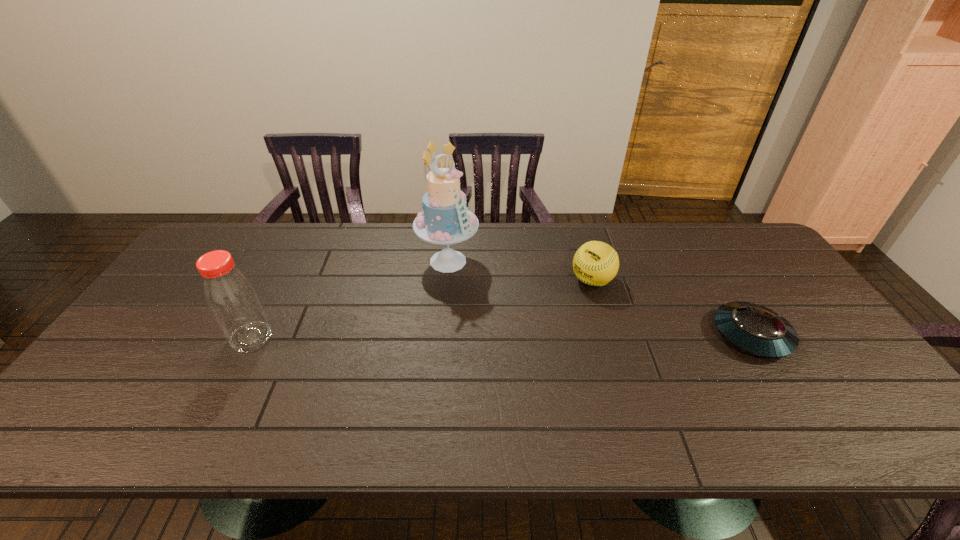
Identify the location of the third shortest object. This screenshot has width=960, height=540. (230, 296).

Locate an element on the screen. The height and width of the screenshot is (540, 960). bottle is located at coordinates (230, 296).

Where is `the rightmost object`? This screenshot has width=960, height=540. the rightmost object is located at coordinates (757, 330).

I want to click on the shortest object, so click(757, 330).

The height and width of the screenshot is (540, 960). In order to click on the third tallest object in this screenshot , I will do `click(595, 263)`.

The image size is (960, 540). I want to click on softball, so click(x=595, y=263).

Where is `cake`? This screenshot has height=540, width=960. cake is located at coordinates (446, 220).

Locate an element on the screen. the tallest object is located at coordinates (446, 220).

Where is `free region located 0.160m on the back of the leftmost object`? The width and height of the screenshot is (960, 540). free region located 0.160m on the back of the leftmost object is located at coordinates (279, 283).

Identify the location of free space located 0.170m on the left of the shortest object. (650, 335).